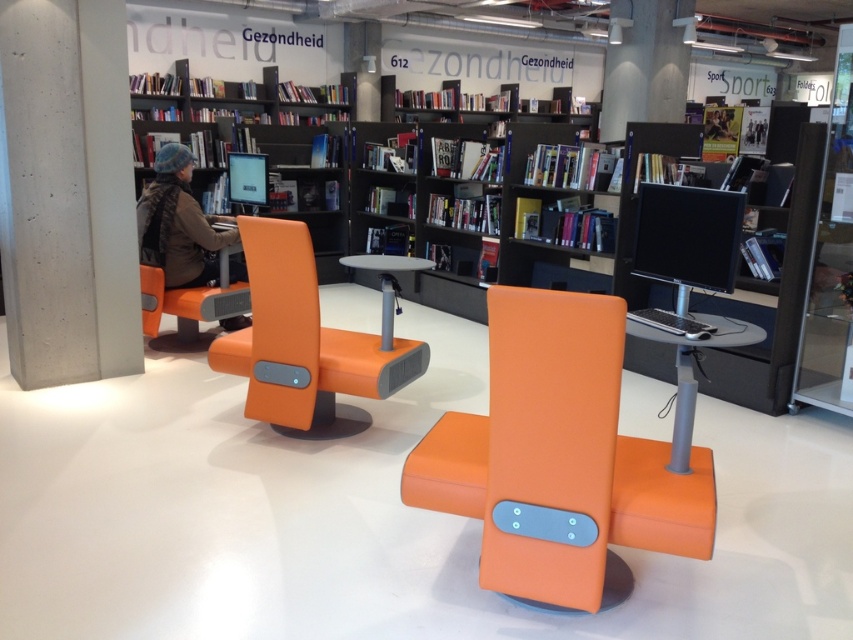
Who is more forward, [289,170] or [660,232]?

Point [660,232]

Where is `matte black bookshelf at upper left`? The height and width of the screenshot is (640, 853). matte black bookshelf at upper left is located at coordinates (277, 172).

Between point (316, 202) and point (723, 276), which one is positioned in front?

Point (723, 276)

This screenshot has width=853, height=640. Identify the location of matte black bookshelf at upper left. (277, 172).

Between orange leather swivel chair at center and orange leather armchair at center, which one has more height?

orange leather armchair at center is taller.

Which is behind, point (489, 424) or point (314, 394)?

The point (314, 394) is more distant.

Between point (508, 480) and point (247, 253), which one is positioned behind?

The point (247, 253) is more distant.

The height and width of the screenshot is (640, 853). In order to click on orange leather swivel chair at center in this screenshot , I will do `click(560, 460)`.

Can you confirm if orange leather armchair at center is positioned to the right of matte black monitor at center?

Incorrect, orange leather armchair at center is not on the right side of matte black monitor at center.

Which is above, orange leather armchair at center or matte black monitor at center?

matte black monitor at center is higher up.

You are a GUI agent. You are given a task and a screenshot of the screen. Output one action in this format:
    pyautogui.click(x=<x>, y=<y>)
    Task: Click on the orange leather armchair at center
    
    Given the screenshot: What is the action you would take?
    pyautogui.click(x=305, y=342)